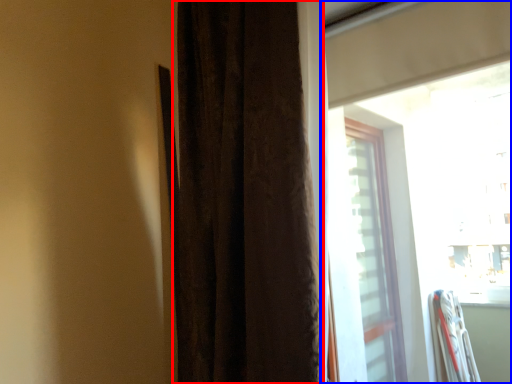
Question: Which of the following is the closest to the observer, curtain (highlighted by a red box) or window (highlighted by a blue box)?

Choices:
 (A) curtain
 (B) window

Answer: (B)